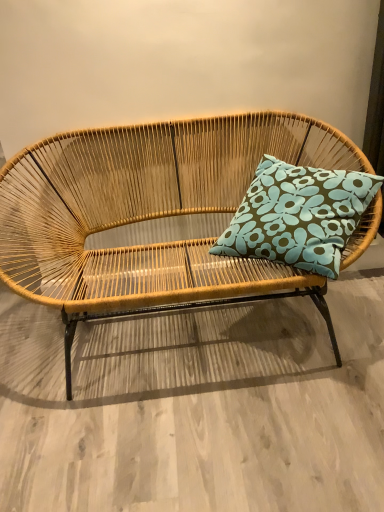
Question: Is teal floral cushion at center taller or shorter than natural woven studio couch at center?

Choices:
 (A) short
 (B) tall

Answer: (A)

Question: From a real-world perspective, relative to natural woven studio couch at center, is teal floral cushion at center vertically above or below?

Choices:
 (A) below
 (B) above

Answer: (B)

Question: Looking at their shapes, would you say teal floral cushion at center is wider or thinner than natural woven studio couch at center?

Choices:
 (A) thin
 (B) wide

Answer: (A)

Question: From the image's perspective, is natural woven studio couch at center positioned above or below teal floral cushion at center?

Choices:
 (A) below
 (B) above

Answer: (A)

Question: Visually, is natural woven studio couch at center positioned to the left or to the right of teal floral cushion at center?

Choices:
 (A) right
 (B) left

Answer: (B)

Question: Considering the positions of natural woven studio couch at center and teal floral cushion at center in the image, is natural woven studio couch at center wider or thinner than teal floral cushion at center?

Choices:
 (A) thin
 (B) wide

Answer: (B)

Question: Is natural woven studio couch at center taller or shorter than teal floral cushion at center?

Choices:
 (A) short
 (B) tall

Answer: (B)